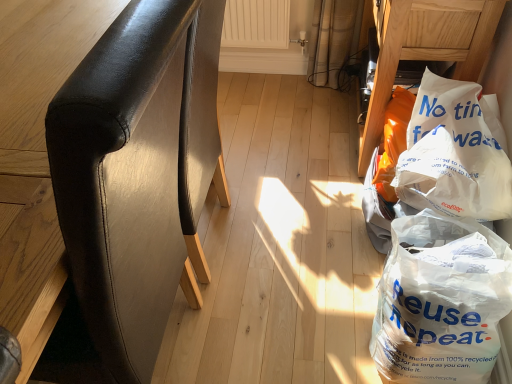
Question: Considering the relative positions of black leather chair at left, the first furniture from the left, and white plastic bag at lower right, positioned as the 1th plastic bag in bottom-to-top order, in the image provided, is black leather chair at left, the first furniture from the left, in front of white plastic bag at lower right, positioned as the 1th plastic bag in bottom-to-top order,?

Choices:
 (A) no
 (B) yes

Answer: (B)

Question: Are black leather chair at left, the first furniture from the left, and white plastic bag at lower right, positioned as the 1th plastic bag in bottom-to-top order, beside each other?

Choices:
 (A) yes
 (B) no

Answer: (B)

Question: Is black leather chair at left, the first furniture from the left, oriented towards white plastic bag at lower right, which is the second plastic bag from top to bottom?

Choices:
 (A) no
 (B) yes

Answer: (A)

Question: From a real-world perspective, is black leather chair at left, the first furniture from the left, located beneath white plastic bag at lower right, positioned as the 1th plastic bag in bottom-to-top order?

Choices:
 (A) no
 (B) yes

Answer: (A)

Question: Can white plastic bag at lower right, positioned as the 1th plastic bag in bottom-to-top order, be found inside black leather chair at left, which ranks as the second furniture in right-to-left order?

Choices:
 (A) no
 (B) yes

Answer: (A)

Question: Considering the relative positions of black leather chair at left, the first furniture from the left, and white plastic bag at lower right, which is the second plastic bag from top to bottom, in the image provided, is black leather chair at left, the first furniture from the left, to the right of white plastic bag at lower right, which is the second plastic bag from top to bottom, from the viewer's perspective?

Choices:
 (A) no
 (B) yes

Answer: (A)

Question: From the image's perspective, is white plastic bag at lower right, which is the 1th furniture in right-to-left order, below white plastic bag at lower right, positioned as the 1th plastic bag in bottom-to-top order?

Choices:
 (A) yes
 (B) no

Answer: (B)

Question: Considering the relative sizes of white plastic bag at lower right, which is the 1th furniture in right-to-left order, and white plastic bag at lower right, positioned as the 1th plastic bag in bottom-to-top order, in the image provided, is white plastic bag at lower right, which is the 1th furniture in right-to-left order, smaller than white plastic bag at lower right, positioned as the 1th plastic bag in bottom-to-top order,?

Choices:
 (A) no
 (B) yes

Answer: (A)

Question: Is white plastic bag at lower right, the second furniture when ordered from left to right, next to white plastic bag at lower right, which is the second plastic bag from top to bottom, and touching it?

Choices:
 (A) yes
 (B) no

Answer: (B)

Question: Is white plastic bag at lower right, the second furniture when ordered from left to right, looking in the opposite direction of white plastic bag at lower right, which is the second plastic bag from top to bottom?

Choices:
 (A) yes
 (B) no

Answer: (B)

Question: Is white plastic bag at lower right, the second furniture when ordered from left to right, at the left side of white plastic bag at lower right, positioned as the 1th plastic bag in bottom-to-top order?

Choices:
 (A) yes
 (B) no

Answer: (B)

Question: Can you confirm if white plastic bag at lower right, the second furniture when ordered from left to right, is wider than white plastic bag at lower right, positioned as the 1th plastic bag in bottom-to-top order?

Choices:
 (A) no
 (B) yes

Answer: (B)

Question: Is white plastic bag at lower right, which is the 1th furniture in right-to-left order, at the back of white plastic bag at lower right, positioned as the 1th plastic bag in bottom-to-top order?

Choices:
 (A) no
 (B) yes

Answer: (A)